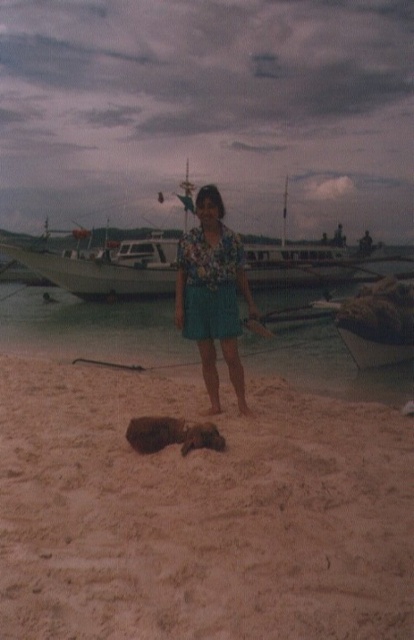
Question: Which of these objects is positioned farthest from the white wooden boat at center?

Choices:
 (A) sandy beach at center
 (B) brown sandy beach at lower center

Answer: (B)

Question: Which of the following is the closest to the observer?

Choices:
 (A) (245, 300)
 (B) (195, 492)
 (C) (255, 260)
 (D) (124, 321)

Answer: (B)

Question: Is white wooden boat at center to the left of floral fabric dress at center from the viewer's perspective?

Choices:
 (A) no
 (B) yes

Answer: (B)

Question: Does sandy beach at center have a larger size compared to floral fabric dress at center?

Choices:
 (A) yes
 (B) no

Answer: (A)

Question: Which object is positioned closest to the sandy beach at center?

Choices:
 (A) white wooden boat at center
 (B) floral fabric dress at center

Answer: (A)

Question: Is brown sandy beach at lower center further to camera compared to floral fabric dress at center?

Choices:
 (A) yes
 (B) no

Answer: (B)